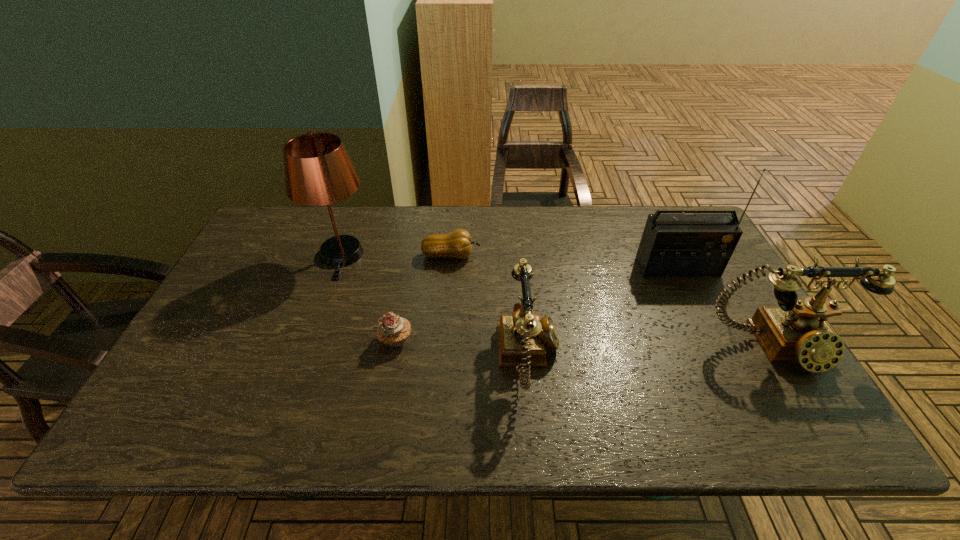
This screenshot has width=960, height=540. I want to click on blank space at the near edge of the desktop, so click(x=341, y=393).

You are a GUI agent. You are given a task and a screenshot of the screen. Output one action in this format:
    pyautogui.click(x=<x>, y=<y>)
    Task: Click on the vacant point at the left edge
    
    Given the screenshot: What is the action you would take?
    pyautogui.click(x=198, y=326)

Where is `vacant region at the right edge of the desktop`? Image resolution: width=960 pixels, height=540 pixels. vacant region at the right edge of the desktop is located at coordinates (703, 281).

This screenshot has width=960, height=540. I want to click on vacant area at the near right corner of the desktop, so click(763, 375).

Locate an element on the screen. This screenshot has width=960, height=540. vacant area between the leftmost object and the cupcake is located at coordinates (369, 298).

Find the location of a particular element. Image resolution: width=960 pixels, height=540 pixels. free space between the left telephone and the taller telephone is located at coordinates (653, 352).

Locate an element on the screen. This screenshot has width=960, height=540. vacant space in between the radio receiver and the taller telephone is located at coordinates (727, 307).

The width and height of the screenshot is (960, 540). Find the location of `free spot between the radio receiver and the lampshade`. free spot between the radio receiver and the lampshade is located at coordinates (510, 262).

Find the location of a particular element. The height and width of the screenshot is (540, 960). unoccupied area between the leftmost object and the radio receiver is located at coordinates (510, 262).

Identify the location of empty space between the leftmost object and the fourth shortest object. (559, 301).